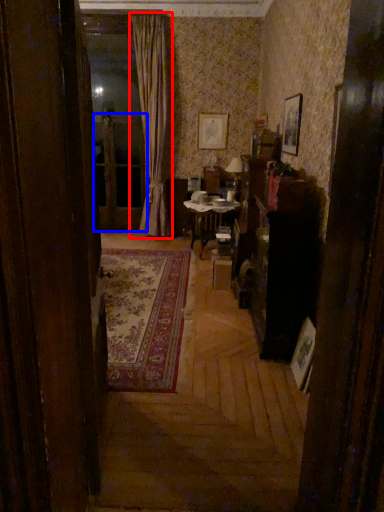
Question: Among these objects, which one is nearest to the camera, curtain (highlighted by a red box) or screen door (highlighted by a blue box)?

Choices:
 (A) curtain
 (B) screen door

Answer: (A)